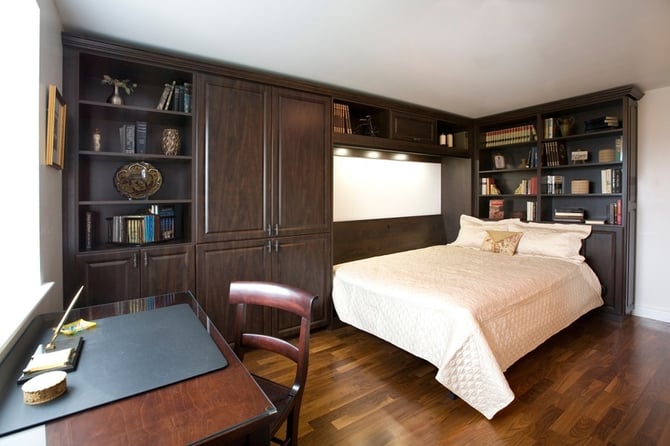
Find the location of a particular element. table is located at coordinates (194, 415).